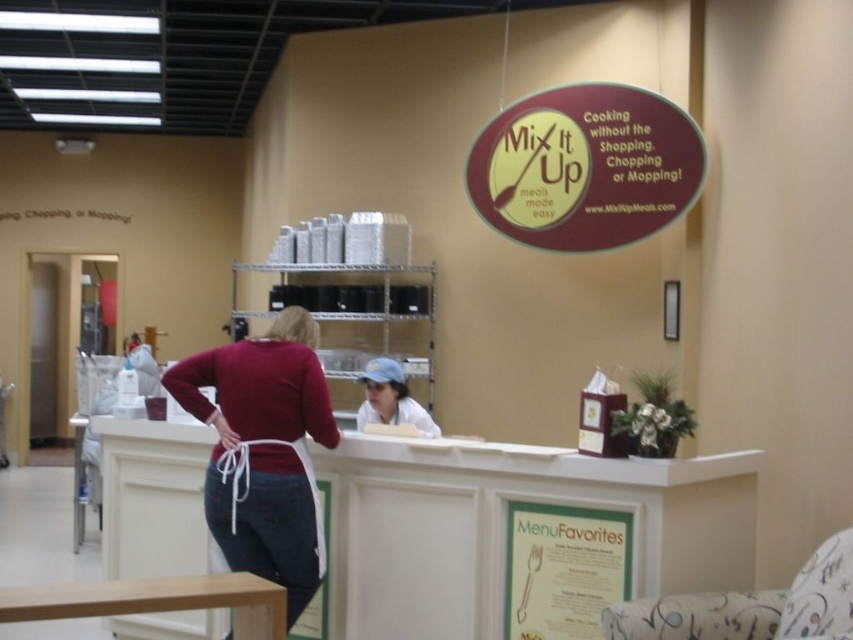
You are a customer at Mix It Up and want to place an order. The counter has a sign above it. Which object, the white glossy counter at center or the matte white apron at center, should you approach to interact with the staff?

You should approach the white glossy counter at center to interact with the staff since it is the larger object and typically where orders are placed in such settings.

You are a customer in the store and want to place an order at the counter. Can you fit your shopping bag on the white glossy counter at center next to the matte white apron at center?

The white glossy counter at center is wider than the matte white apron at center, so there should be enough space to place your shopping bag next to the matte white apron at center on the counter.

You are a customer looking at the white glossy counter at center and the matte white apron at center. Which object is located above the other?

The matte white apron at center is above the white glossy counter at center because the counter is positioned under the apron.